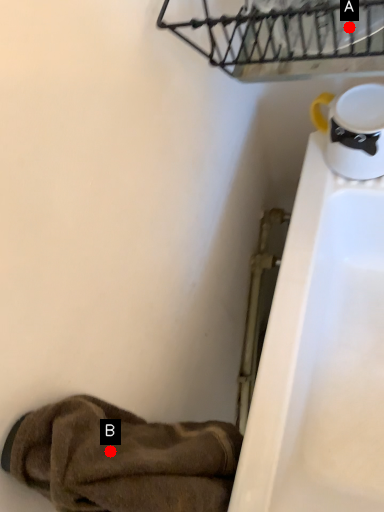
Question: Two points are circled on the image, labeled by A and B beside each circle. Which point appears closest to the camera in this image?

Choices:
 (A) A is closer
 (B) B is closer

Answer: (B)